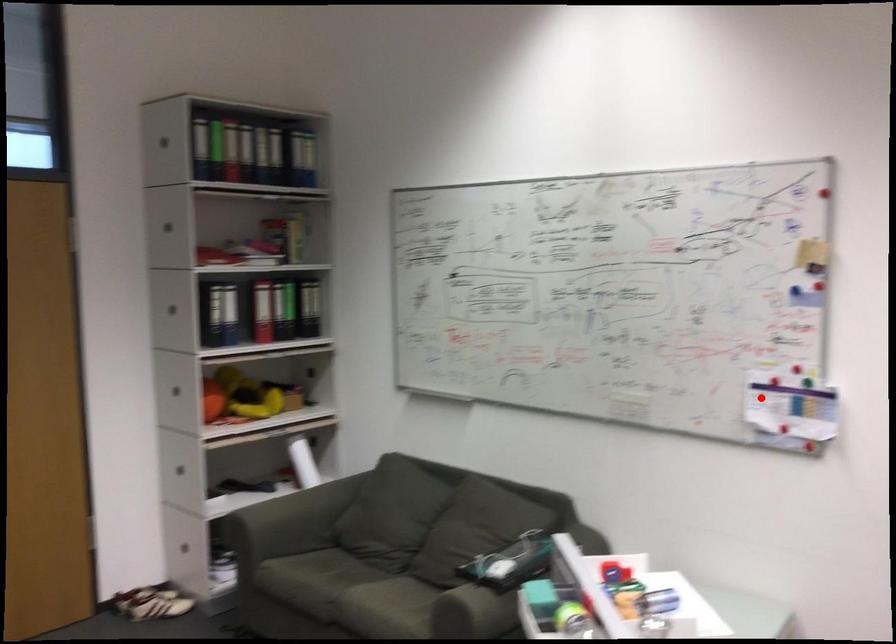
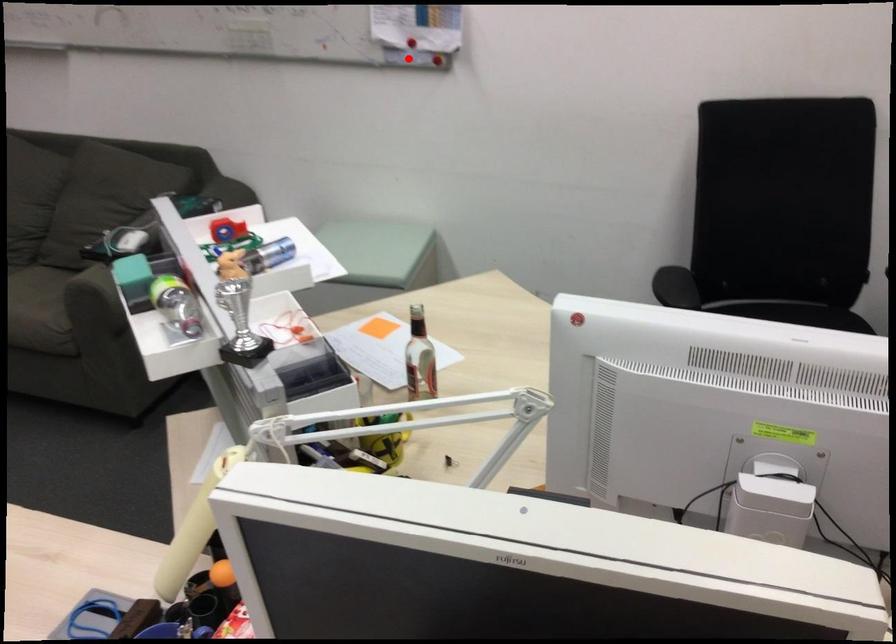
I am providing you with two images of the same scene from different viewpoints. A red point is marked on the first image and another point is marked on the second image. Is the red point in image1 aligned with the point shown in image2?

No